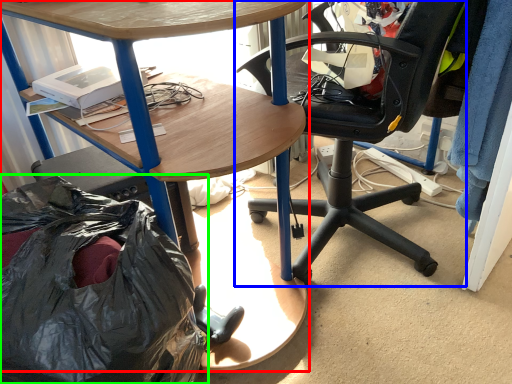
Question: Based on their relative distances, which object is nearer to desk (highlighted by a red box)? Choose from chair (highlighted by a blue box) and garbage (highlighted by a green box).

Choices:
 (A) chair
 (B) garbage

Answer: (B)